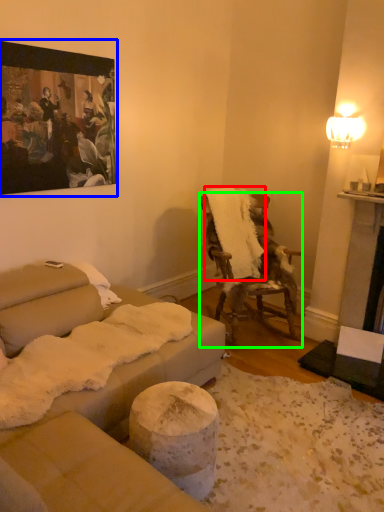
Question: Considering the real-world distances, which object is closest to blanket (highlighted by a red box)? picture frame (highlighted by a blue box) or chair (highlighted by a green box).

Choices:
 (A) picture frame
 (B) chair

Answer: (B)